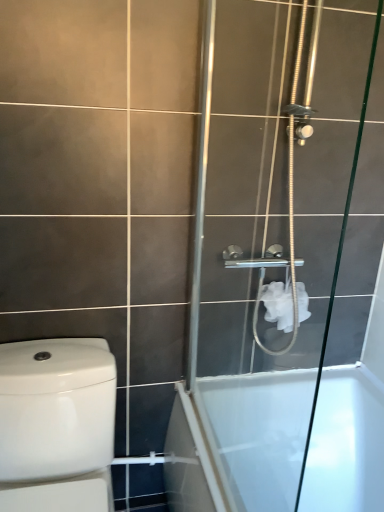
Describe the element at coordinates (281, 234) in the screenshot. I see `clear glass shower door at right` at that location.

Image resolution: width=384 pixels, height=512 pixels. What do you see at coordinates (278, 304) in the screenshot?
I see `white matte toilet paper at upper right` at bounding box center [278, 304].

At what (x,y) coordinates should I click in order to perform the action: click on white matte toilet paper at upper right. Please return your answer as a coordinate pair (x, y). Looking at the image, I should click on (278, 304).

You are a GUI agent. You are given a task and a screenshot of the screen. Output one action in this format:
    pyautogui.click(x=<x>, y=<y>)
    Task: Click on the clear glass shower door at right
    The image size is (384, 512).
    Given the screenshot: What is the action you would take?
    pyautogui.click(x=281, y=234)

From a real-world perspective, is white matte toilet paper at upper right under clear glass shower door at right?

Correct, in the physical world, white matte toilet paper at upper right is lower than clear glass shower door at right.

Does point (274, 314) appear closer or farther from the camera than point (242, 98)?

Point (274, 314) is farther from the camera than point (242, 98).

Is clear glass shower door at right at the back of white matte toilet paper at upper right?

That's not correct — white matte toilet paper at upper right is not looking away from clear glass shower door at right.

Is white matte toilet paper at upper right positioned beyond the bounds of clear glass shower door at right?

Yes, white matte toilet paper at upper right is located beyond the bounds of clear glass shower door at right.

Looking at this image, from a real-world perspective, is white matte toilet paper at upper right positioned under white glossy toilet at left based on gravity?

No.

Is white matte toilet paper at upper right at the left side of white glossy toilet at left?

Incorrect, white matte toilet paper at upper right is not on the left side of white glossy toilet at left.

Can white glossy toilet at left be found inside white matte toilet paper at upper right?

That's incorrect, white glossy toilet at left is not inside white matte toilet paper at upper right.

This screenshot has width=384, height=512. I want to click on toilet paper located behind the white glossy bathtub at lower right, so click(x=278, y=304).

Is white glossy bathtub at lower right at the right side of white matte toilet paper at upper right?

Yes, white glossy bathtub at lower right is to the right of white matte toilet paper at upper right.

Does point (169, 449) come closer to viewer compared to point (271, 309)?

No, (169, 449) is behind (271, 309).

How distant is white glossy bathtub at lower right from white matte toilet paper at upper right?

white glossy bathtub at lower right and white matte toilet paper at upper right are 41.75 centimeters apart from each other.

Considering the sizes of objects white glossy toilet at left and white glossy bathtub at lower right in the image provided, who is smaller, white glossy toilet at left or white glossy bathtub at lower right?

white glossy toilet at left is smaller.

Which point is more distant from viewer, (38, 509) or (198, 473)?

The point (198, 473) is behind.

Is white glossy toilet at left to the right of white glossy bathtub at lower right from the viewer's perspective?

Incorrect, white glossy toilet at left is not on the right side of white glossy bathtub at lower right.

Based on their positions, is clear glass shower door at right located to the left or right of white glossy bathtub at lower right?

clear glass shower door at right is to the left of white glossy bathtub at lower right.

Considering the points (280, 191) and (277, 432), which point is behind, point (280, 191) or point (277, 432)?

The point (277, 432) is behind.

Are clear glass shower door at right and white glossy bathtub at lower right beside each other?

No.

Which of these two, clear glass shower door at right or white glossy bathtub at lower right, is thinner?

Thinner between the two is clear glass shower door at right.

Is clear glass shower door at right touching white glossy toilet at left?

They are not placed beside each other.

Where is `toilet below the clear glass shower door at right (from a real-world perspective)`? Image resolution: width=384 pixels, height=512 pixels. toilet below the clear glass shower door at right (from a real-world perspective) is located at coordinates (56, 424).

Considering the relative sizes of clear glass shower door at right and white glossy toilet at left in the image provided, is clear glass shower door at right smaller than white glossy toilet at left?

Correct, clear glass shower door at right occupies less space than white glossy toilet at left.

Is clear glass shower door at right oriented towards white glossy toilet at left?

Yes.

Does point (276, 184) lie in front of point (307, 314)?

Yes, point (276, 184) is closer to viewer.

From the picture: Is clear glass shower door at right facing away from white matte toilet paper at upper right?

Absolutely, clear glass shower door at right is directed away from white matte toilet paper at upper right.

From the image's perspective, is clear glass shower door at right above or below white matte toilet paper at upper right?

Clearly, from the image's perspective, clear glass shower door at right is above white matte toilet paper at upper right.

Visually, is clear glass shower door at right positioned to the left or to the right of white matte toilet paper at upper right?

Clearly, clear glass shower door at right is on the left of white matte toilet paper at upper right in the image.

Find the location of `screen door located above the white matte toilet paper at upper right (from the image's perspective)`. screen door located above the white matte toilet paper at upper right (from the image's perspective) is located at coordinates (281, 234).

Where is `toilet below the white matte toilet paper at upper right (from the image's perspective)`? The height and width of the screenshot is (512, 384). toilet below the white matte toilet paper at upper right (from the image's perspective) is located at coordinates (56, 424).

When comparing their distances from white matte toilet paper at upper right, does white glossy bathtub at lower right or white glossy toilet at left seem further?

Based on the image, white glossy toilet at left appears to be further to white matte toilet paper at upper right.

When comparing their distances from white matte toilet paper at upper right, does white glossy toilet at left or clear glass shower door at right seem closer?

clear glass shower door at right is positioned closer to the anchor white matte toilet paper at upper right.

Estimate the real-world distances between objects in this image. Which object is closer to white glossy bathtub at lower right, white matte toilet paper at upper right or white glossy toilet at left?

white matte toilet paper at upper right.

Based on their spatial positions, is white glossy bathtub at lower right or white glossy toilet at left further from clear glass shower door at right?

white glossy toilet at left is further to clear glass shower door at right.

Estimate the real-world distances between objects in this image. Which object is further from white matte toilet paper at upper right, white glossy bathtub at lower right or clear glass shower door at right?

white glossy bathtub at lower right is positioned further to the anchor white matte toilet paper at upper right.

Which object lies further to the anchor point white glossy toilet at left, white glossy bathtub at lower right or clear glass shower door at right?

The object further to white glossy toilet at left is clear glass shower door at right.

Looking at this image, estimate the real-world distances between objects in this image. Which object is closer to white matte toilet paper at upper right, clear glass shower door at right or white glossy bathtub at lower right?

clear glass shower door at right is positioned closer to the anchor white matte toilet paper at upper right.

Based on their spatial positions, is white matte toilet paper at upper right or clear glass shower door at right further from white glossy toilet at left?

white matte toilet paper at upper right.

This screenshot has width=384, height=512. I want to click on toilet paper between white glossy toilet at left and white glossy bathtub at lower right from left to right, so click(x=278, y=304).

Image resolution: width=384 pixels, height=512 pixels. I want to click on toilet between clear glass shower door at right and white glossy bathtub at lower right in the vertical direction, so click(56, 424).

This screenshot has height=512, width=384. What are the coordinates of `toilet between clear glass shower door at right and white matte toilet paper at upper right in the front-back direction` in the screenshot? It's located at (56, 424).

Where is `bathtub between clear glass shower door at right and white matte toilet paper at upper right from front to back`? bathtub between clear glass shower door at right and white matte toilet paper at upper right from front to back is located at coordinates (250, 433).